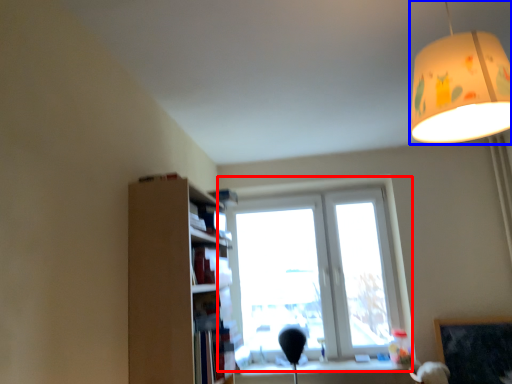
Question: Which of the following is the farthest to the observer, window (highlighted by a red box) or lamp (highlighted by a blue box)?

Choices:
 (A) window
 (B) lamp

Answer: (A)